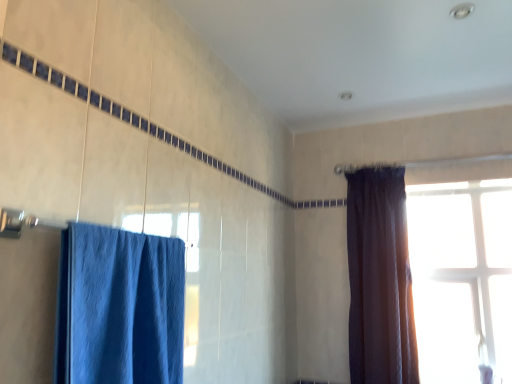
Question: In the image, is transparent glass window at upper right positioned in front of or behind dark velvet curtain at right, the second curtain in the front-to-back sequence?

Choices:
 (A) front
 (B) behind

Answer: (B)

Question: From the image's perspective, relative to dark velvet curtain at right, the second curtain in the front-to-back sequence, is transparent glass window at upper right above or below?

Choices:
 (A) above
 (B) below

Answer: (B)

Question: Which object is the closest to the dark velvet curtain at right, the second curtain in the front-to-back sequence?

Choices:
 (A) transparent glass window at upper right
 (B) blue fabric curtain at left, the 1th curtain from the front

Answer: (A)

Question: Which of these objects is positioned farthest from the dark velvet curtain at right, which ranks as the 1th curtain in back-to-front order?

Choices:
 (A) transparent glass window at upper right
 (B) blue fabric curtain at left, the 1th curtain from the front

Answer: (B)